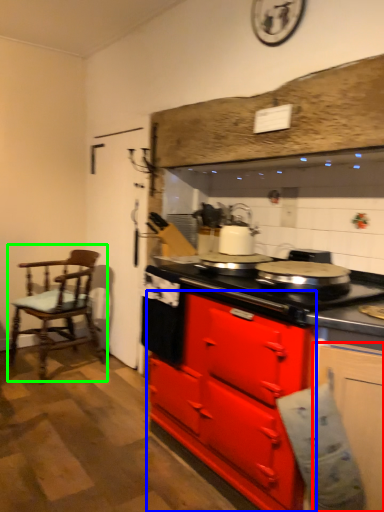
Question: Based on their relative distances, which object is farther from cabinetry (highlighted by a red box)? Choose from cabinetry (highlighted by a blue box) and chair (highlighted by a green box).

Choices:
 (A) cabinetry
 (B) chair

Answer: (B)